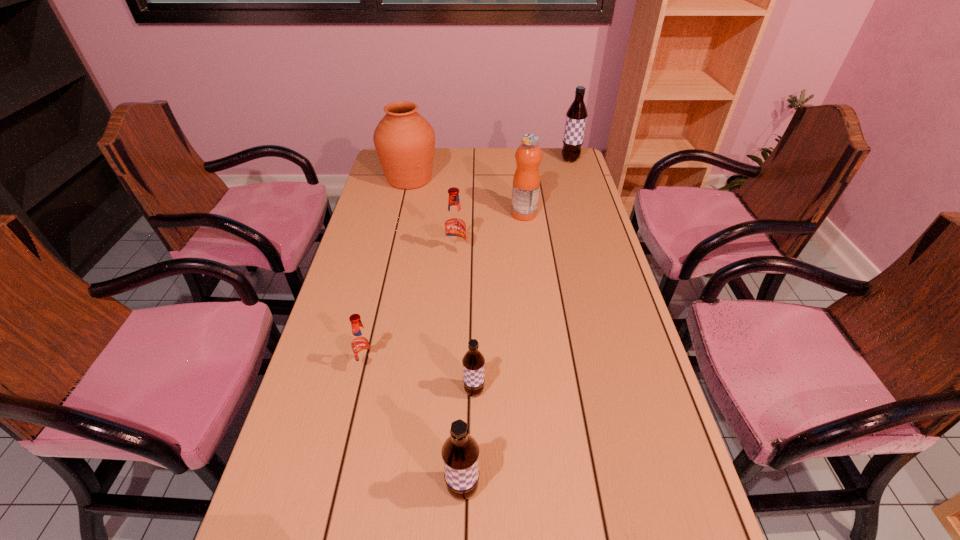
You are a GUI agent. You are given a task and a screenshot of the screen. Output one action in this format:
    pyautogui.click(x=<x>, y=<y>)
    Task: Click on the nearer red root beer
    The image size is (960, 540).
    Given the screenshot: What is the action you would take?
    pyautogui.click(x=362, y=345)

At what (x,y) coordinates should I click in order to perform the action: click on the smaller red root beer. Please return your answer as a coordinate pair (x, y). Looking at the image, I should click on (362, 345).

Where is `the smallest brown root beer`? The image size is (960, 540). the smallest brown root beer is located at coordinates (473, 361).

You are a GUI agent. You are given a task and a screenshot of the screen. Output one action in this format:
    pyautogui.click(x=<x>, y=<y>)
    Task: Click on the second nearest brown root beer
    This screenshot has width=960, height=540.
    Given the screenshot: What is the action you would take?
    pyautogui.click(x=473, y=361)

Find the location of a particular element. Image resolution: width=960 pixels, height=540 pixels. free point located on the front of the biggest brown root beer is located at coordinates (580, 191).

The width and height of the screenshot is (960, 540). What are the coordinates of `free space located 0.150m on the right of the second object from right to left` in the screenshot? It's located at (579, 214).

Find the location of a particular element. This screenshot has height=540, width=960. free space located on the front of the urn is located at coordinates (397, 232).

Locate an element on the screen. vacant region located on the left of the farther red root beer is located at coordinates (393, 254).

I want to click on vacant point located 0.130m on the back of the nearest brown root beer, so pos(465,414).

You are a GUI agent. You are given a task and a screenshot of the screen. Output one action in this format:
    pyautogui.click(x=<x>, y=<y>)
    Task: Click on the vacant space situated on the right of the leftmost root beer
    
    Given the screenshot: What is the action you would take?
    click(430, 366)